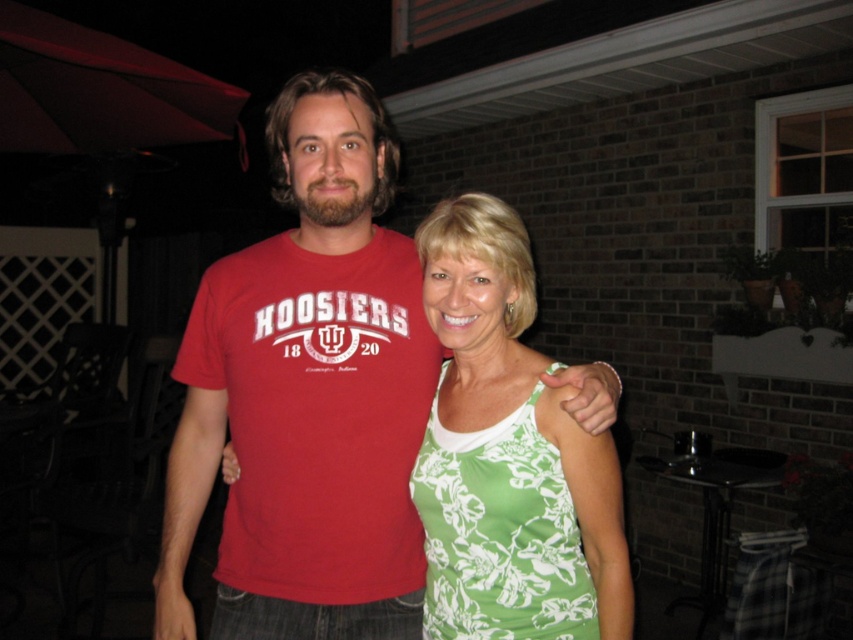
Question: In this image, where is matte red t-shirt at center located relative to green floral tank top at center?

Choices:
 (A) below
 (B) above

Answer: (B)

Question: Which point is closer to the camera?

Choices:
 (A) green floral tank top at center
 (B) matte red t-shirt at center

Answer: (A)

Question: Does matte red t-shirt at center lie behind green floral tank top at center?

Choices:
 (A) no
 (B) yes

Answer: (B)

Question: Among these objects, which one is farthest from the camera?

Choices:
 (A) matte red t-shirt at center
 (B) green floral tank top at center

Answer: (A)

Question: Which point appears closest to the camera in this image?

Choices:
 (A) (294, 472)
 (B) (595, 625)

Answer: (B)

Question: Is matte red t-shirt at center closer to the viewer compared to green floral tank top at center?

Choices:
 (A) yes
 (B) no

Answer: (B)